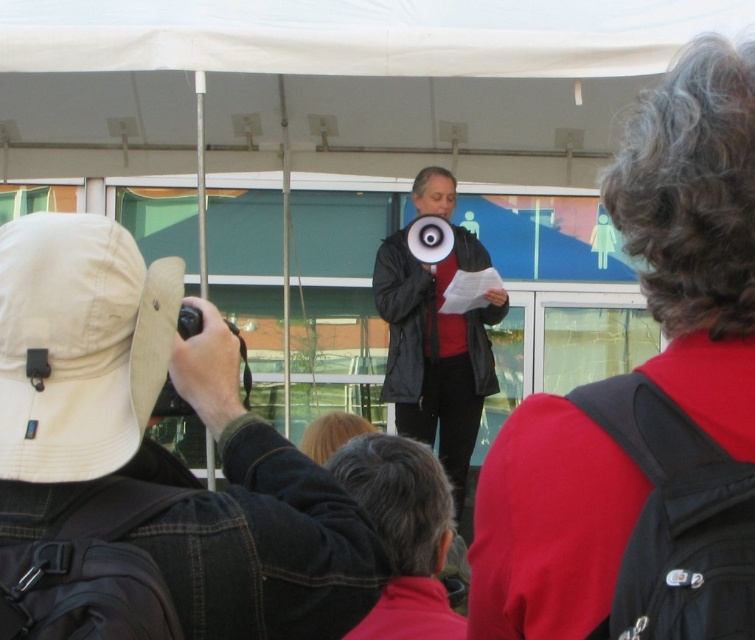
Question: Which object appears closest to the camera in this image?

Choices:
 (A) tan fabric hat at upper left
 (B) black matte jacket at center

Answer: (A)

Question: Which point is closer to the camera taking this photo?

Choices:
 (A) (479, 353)
 (B) (353, 557)

Answer: (B)

Question: Does tan fabric hat at upper left appear over black matte jacket at center?

Choices:
 (A) no
 (B) yes

Answer: (B)

Question: From the image, what is the correct spatial relationship of tan fabric hat at upper left in relation to black matte jacket at center?

Choices:
 (A) below
 (B) above

Answer: (B)

Question: Is tan fabric hat at upper left thinner than black matte jacket at center?

Choices:
 (A) yes
 (B) no

Answer: (A)